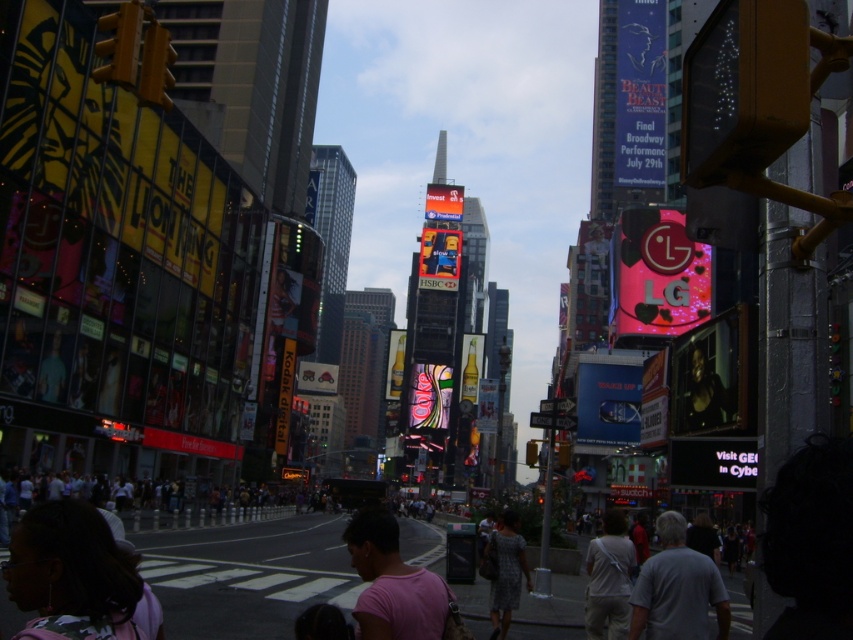
You are standing at the intersection in the image and want to find the pink cotton shirt at center. According to the coordinates given, where should you look relative to the center of the image?

The pink cotton shirt at center is located at coordinates approximately 91.1 percent from the left edge and 46.1 percent from the top edge of the image.

You are a fashion photographer who wants to capture the pink cotton shirt at center in your photo. The camera you are using has a focal length of 50mm. If you want to ensure the shirt is in focus, which part of the image should you focus on?

You should focus on the pink cotton shirt at center since it is the main subject and positioned at point (x=392, y=582), which is the center of the image.